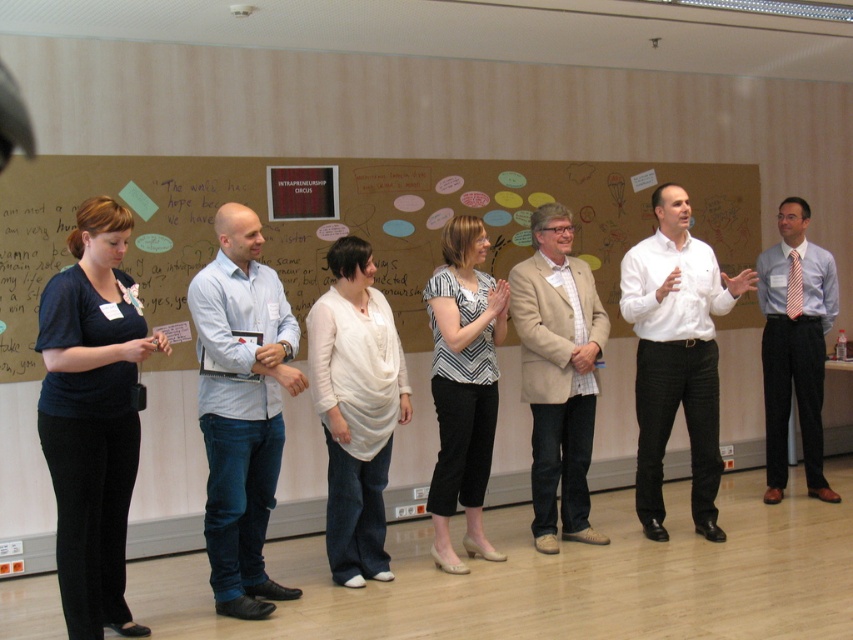
Question: Which object is closer to the camera taking this photo?

Choices:
 (A) beige fabric blazer at center
 (B) dark blue jersey at left

Answer: (B)

Question: Is light blue denim jeans at center wider than white shirt at center?

Choices:
 (A) no
 (B) yes

Answer: (A)

Question: Which point is farther to the camera?

Choices:
 (A) dark blue jersey at left
 (B) white shirt at center
 (C) white soft fabric blouse at center
 (D) beige fabric blazer at center

Answer: (D)

Question: Does dark blue jersey at left appear on the right side of light blue denim jeans at center?

Choices:
 (A) no
 (B) yes

Answer: (A)

Question: Can you confirm if wooden corkboard at center is positioned to the right of striped tie at center?

Choices:
 (A) yes
 (B) no

Answer: (B)

Question: Among these objects, which one is farthest from the camera?

Choices:
 (A) white shirt at center
 (B) white soft fabric blouse at center
 (C) striped tie at center
 (D) dark blue jersey at left

Answer: (C)